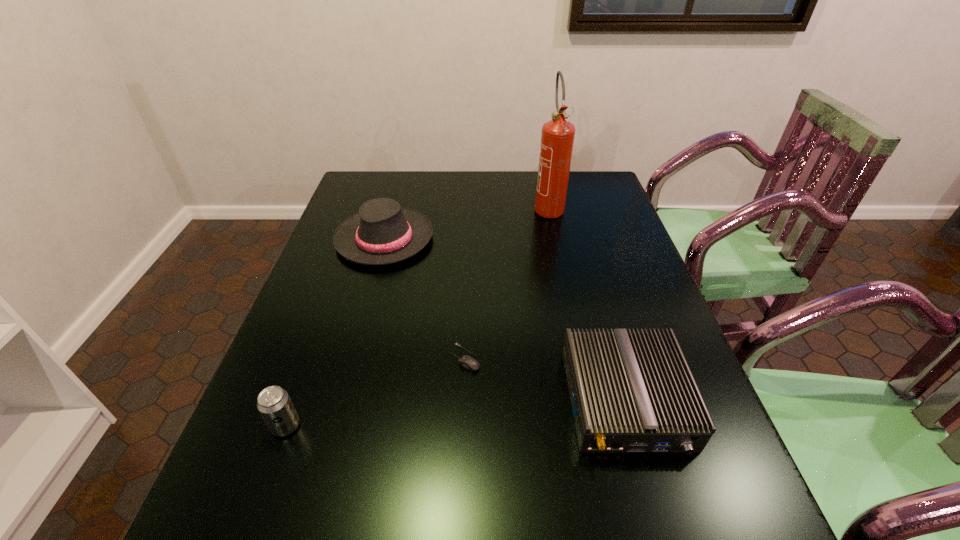
I want to click on fire extinguisher, so click(x=557, y=138).

In order to click on dress hat in this screenshot , I will do `click(382, 232)`.

Find the location of a particular element. beer can is located at coordinates (274, 404).

This screenshot has height=540, width=960. In order to click on router in this screenshot , I will do `click(632, 391)`.

Image resolution: width=960 pixels, height=540 pixels. In order to click on the shortest object in this screenshot , I will do `click(469, 363)`.

Find the location of a particular element. The height and width of the screenshot is (540, 960). the third object from left to right is located at coordinates (469, 363).

Locate an element on the screen. vacant area situated 0.390m from the nozzle of the fire extinguisher is located at coordinates (570, 310).

Find the location of `vacant space located on the right of the dress hat`. vacant space located on the right of the dress hat is located at coordinates coord(456,239).

At what (x,y) coordinates should I click in order to perform the action: click on free space located on the back of the beer can. Please return your answer as a coordinate pair (x, y). Looking at the image, I should click on (302, 381).

Where is `vacant space located 0.120m on the back panel of the router`? vacant space located 0.120m on the back panel of the router is located at coordinates (663, 534).